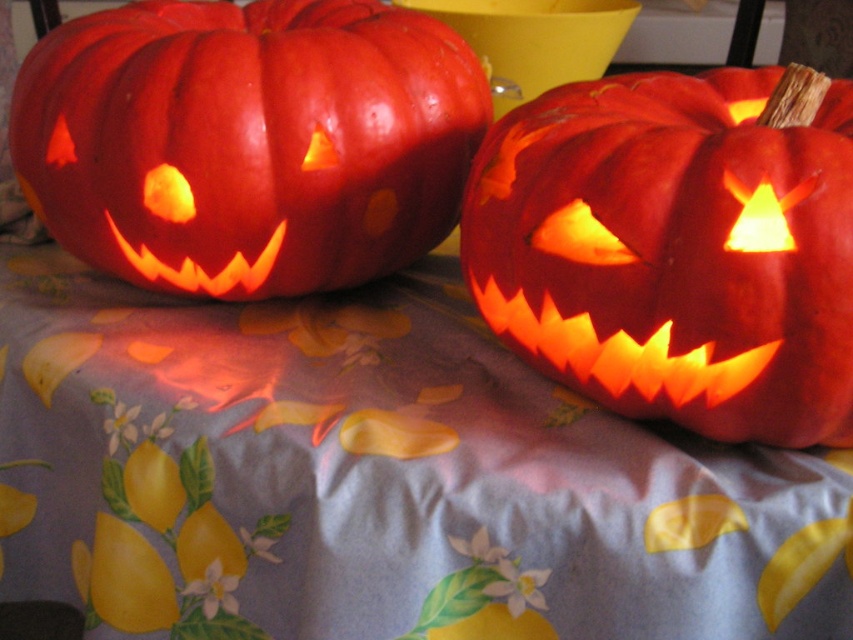
Does matte orange pumpkin at center appear on the right side of matte orange pumpkin at left?

Yes, matte orange pumpkin at center is to the right of matte orange pumpkin at left.

The width and height of the screenshot is (853, 640). In order to click on matte orange pumpkin at center in this screenshot , I will do `click(677, 246)`.

The height and width of the screenshot is (640, 853). Find the location of `matte orange pumpkin at center`. matte orange pumpkin at center is located at coordinates (677, 246).